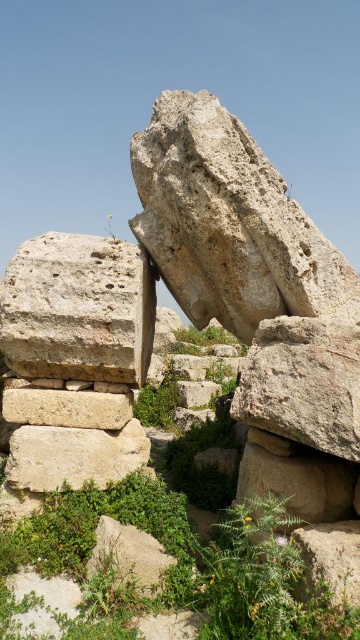
Which of these two, gray rough stone at center or beige stone at center, stands shorter?

With less height is beige stone at center.

Measure the distance between gray rough stone at center and beige stone at center.

The distance of gray rough stone at center from beige stone at center is 15.22 inches.

Is point (88, 369) more distant than point (64, 467)?

Yes, point (88, 369) is behind point (64, 467).

Find the location of a particular element. This screenshot has height=640, width=360. gray rough stone at center is located at coordinates (78, 308).